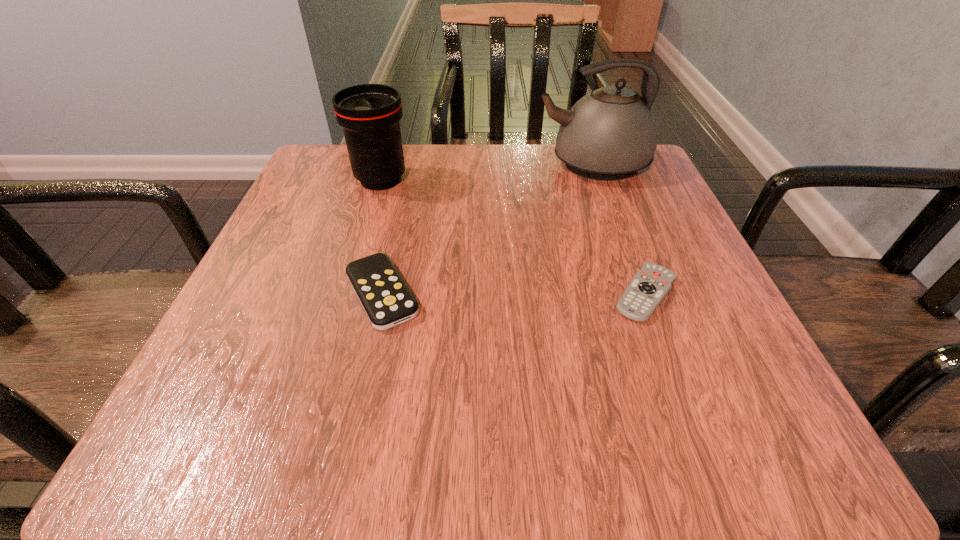
Where is `vacant area between the second tallest object and the right remote control`? This screenshot has height=540, width=960. vacant area between the second tallest object and the right remote control is located at coordinates (514, 237).

The height and width of the screenshot is (540, 960). What are the coordinates of `free spot between the telephoto lens and the left remote control` in the screenshot? It's located at (381, 237).

The image size is (960, 540). I want to click on vacant area that lies between the telephoto lens and the third tallest object, so click(381, 237).

The image size is (960, 540). Find the location of `blank region between the kettle and the left remote control`. blank region between the kettle and the left remote control is located at coordinates (487, 229).

You are a GUI agent. You are given a task and a screenshot of the screen. Output one action in this format:
    pyautogui.click(x=<x>, y=<y>)
    Task: Click on the free space that is in between the second tallest object and the right remote control
    The image size is (960, 540).
    Given the screenshot: What is the action you would take?
    pyautogui.click(x=514, y=237)

Locate an element on the screen. vacant region between the right remote control and the tallest object is located at coordinates (619, 229).

Select which object appears as the third closest to the second tallest object. Please provide its 2D coordinates. Your answer should be formatted as a tuple, i.e. [(x, y)], where the tuple contains the x and y coordinates of a point satisfying the conditions above.

[(649, 286)]

Where is `object that stands as the third closest to the telephoto lens`? The height and width of the screenshot is (540, 960). object that stands as the third closest to the telephoto lens is located at coordinates 649,286.

Locate an element on the screen. vacant region that satisfies the following two spatial constraints: 1. at the spout of the right remote control; 2. on the right side of the kettle is located at coordinates (638, 294).

You are a GUI agent. You are given a task and a screenshot of the screen. Output one action in this format:
    pyautogui.click(x=<x>, y=<y>)
    Task: Click on the blank space that satisfies the following two spatial constraints: 1. on the front side of the right remote control; 2. on the left side of the third shortest object
    Image resolution: width=960 pixels, height=540 pixels.
    Given the screenshot: What is the action you would take?
    pyautogui.click(x=347, y=294)